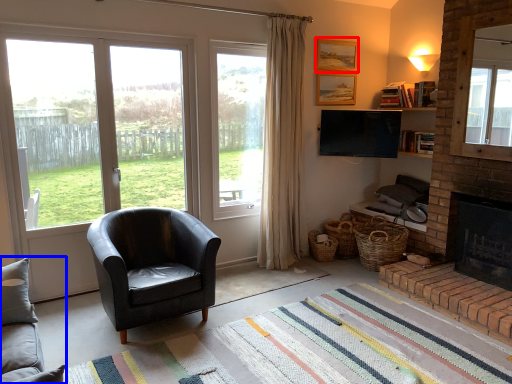
Question: Which of the following is the closest to the observer, picture frame (highlighted by a red box) or studio couch (highlighted by a blue box)?

Choices:
 (A) picture frame
 (B) studio couch

Answer: (B)